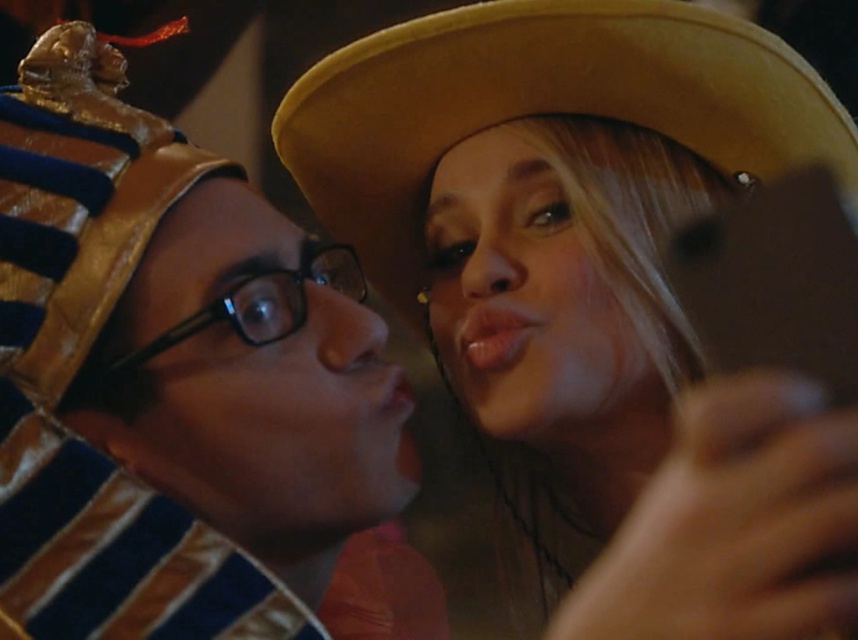
You are a photographer trying to capture a clear shot of both the light brown felt cowboy hat at upper center and the black plastic glasses at center. Considering their sizes, which object should you focus on first to ensure it fits within the frame?

The light brown felt cowboy hat at upper center might be wider than the black plastic glasses at center, so you should focus on ensuring the wider object fits first.